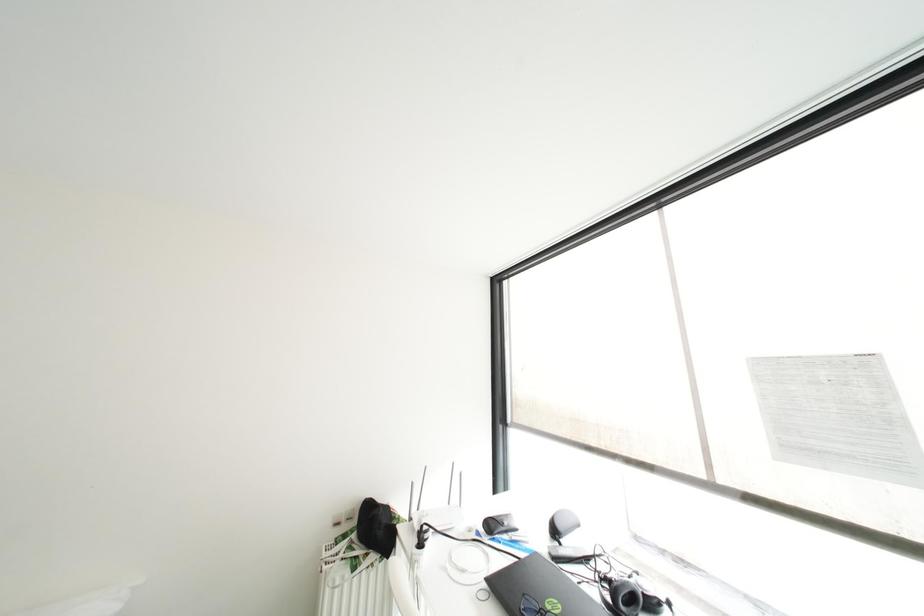
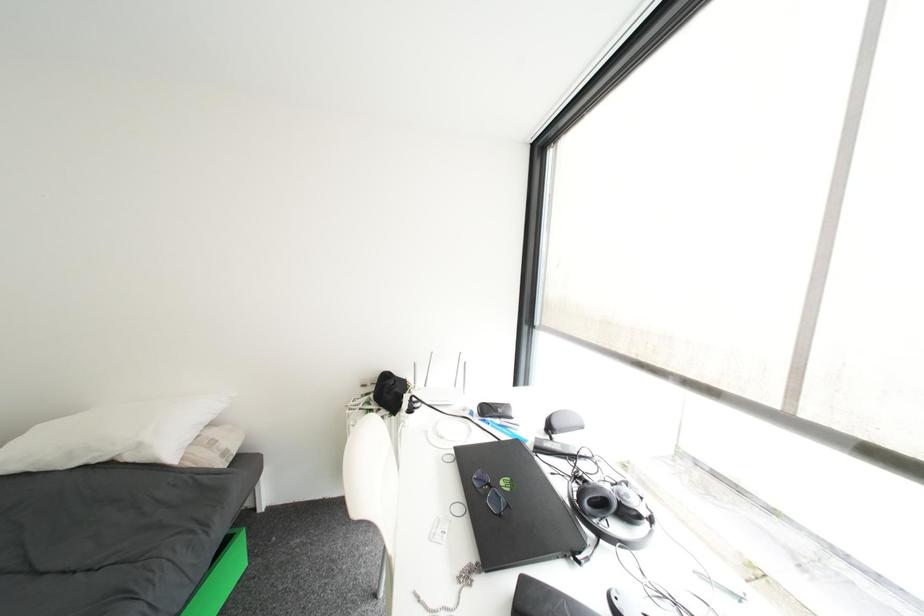
Which direction would the cameraman need to move to produce the second image?

The cameraman moved toward right, forward.